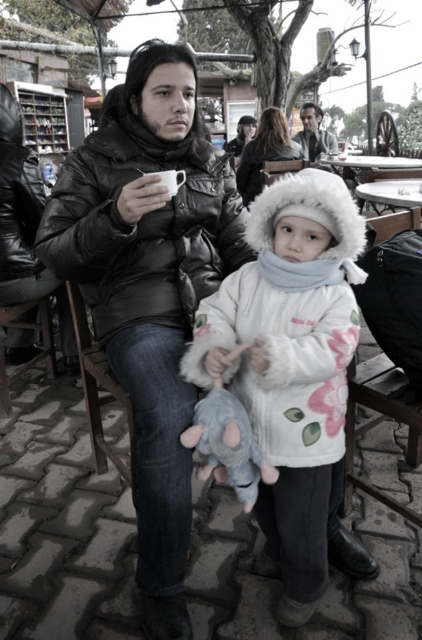
Is white fluffy coat at center smaller than white glossy picnic table at upper center?

No.

You are a GUI agent. You are given a task and a screenshot of the screen. Output one action in this format:
    pyautogui.click(x=<x>, y=<y>)
    Task: Click on the white fluffy coat at center
    
    Given the screenshot: What is the action you would take?
    pyautogui.click(x=294, y=372)

Does wooden at left appear over white glossy picnic table at upper center?

No, wooden at left is not above white glossy picnic table at upper center.

Does wooden at left appear on the left side of white glossy picnic table at upper center?

Yes, wooden at left is to the left of white glossy picnic table at upper center.

Is point (81, 326) farther from camera compared to point (395, 188)?

No, it is not.

At what (x,y) coordinates should I click in order to perform the action: click on wooden at left. Please return your answer as a coordinate pair (x, y). Looking at the image, I should click on (97, 387).

Measure the distance between plush gray mouse at center and white glossy picnic table at upper center.

A distance of 2.20 meters exists between plush gray mouse at center and white glossy picnic table at upper center.

Can you confirm if plush gray mouse at center is thinner than white glossy picnic table at upper center?

Yes, plush gray mouse at center is thinner than white glossy picnic table at upper center.

Who is more distant from viewer, (254, 449) or (386, 189)?

Positioned behind is point (386, 189).

You are a GUI agent. You are given a task and a screenshot of the screen. Output one action in this format:
    pyautogui.click(x=<x>, y=<y>)
    Task: Click on the plush gray mouse at center
    This screenshot has height=640, width=422.
    Given the screenshot: What is the action you would take?
    pyautogui.click(x=227, y=444)